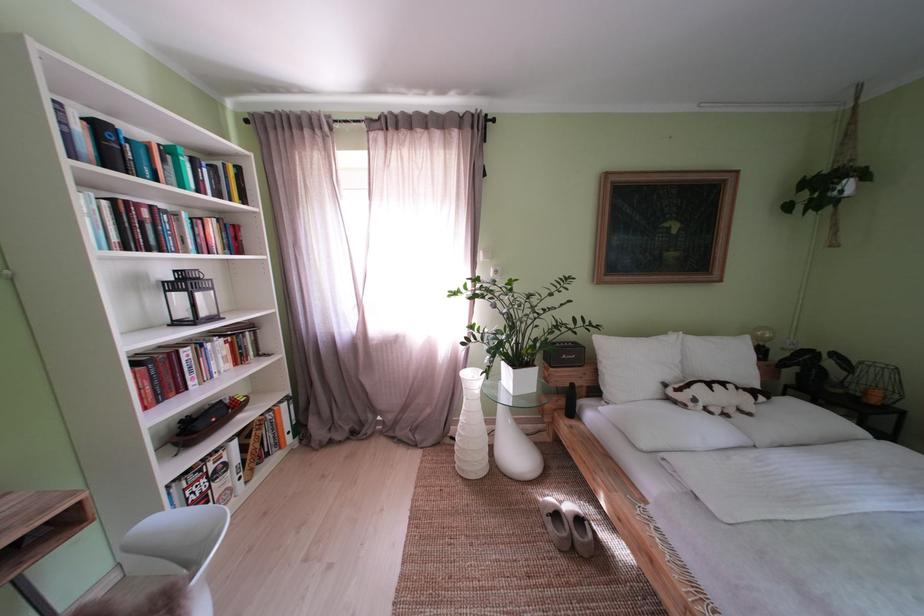
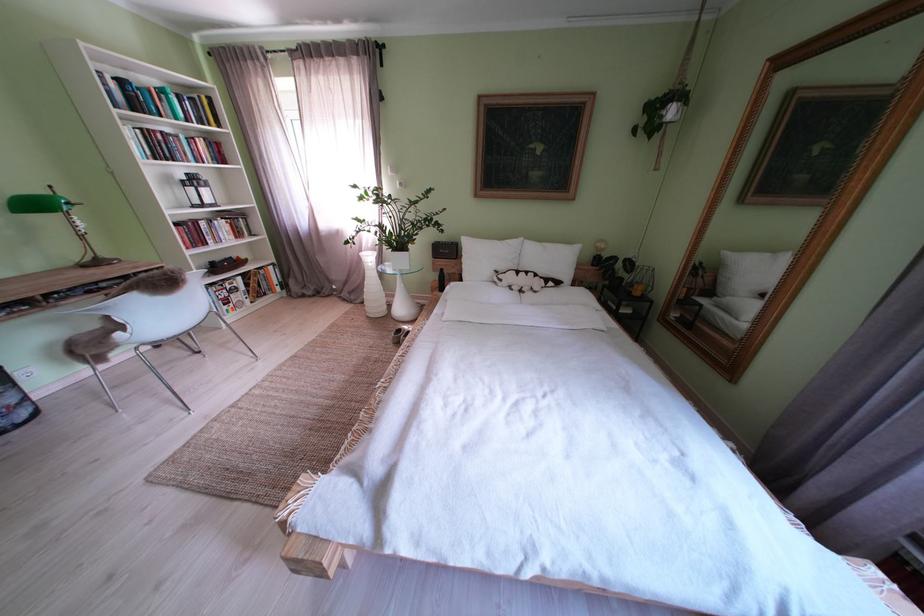
Where in the second image is the point corresponding to point 639,369 from the first image?

(490, 262)